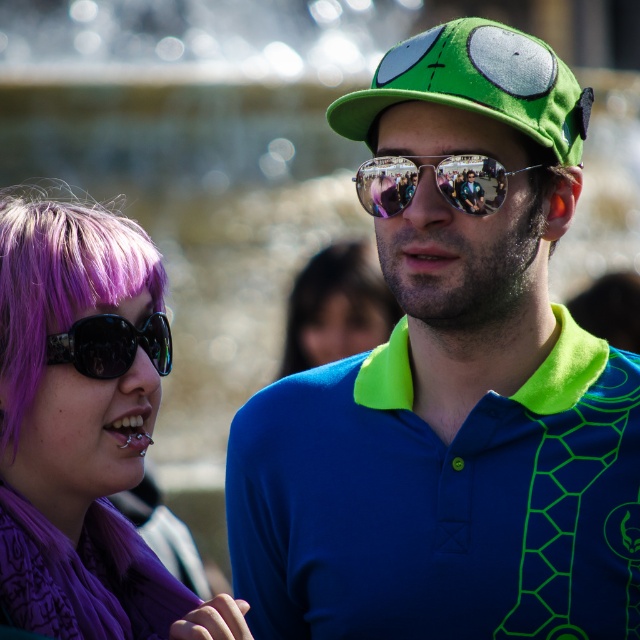
Question: Which object is farther from the camera taking this photo?

Choices:
 (A) purple hair at left
 (B) purple fabric scarf at left
 (C) matte green cap at upper right
 (D) shiny black sunglasses at lower left

Answer: (D)

Question: Can you confirm if matte green cap at upper right is bigger than green felt hat at upper center?

Choices:
 (A) no
 (B) yes

Answer: (B)

Question: Which object is the farthest from the matte green cap at upper right?

Choices:
 (A) purple hair at center
 (B) purple fabric scarf at left
 (C) green felt hat at upper center
 (D) reflective plastic goggles at center

Answer: (A)

Question: Which is farther from the matte green cap at upper right?

Choices:
 (A) shiny black sunglasses at lower left
 (B) reflective plastic goggles at center
 (C) green felt hat at upper center

Answer: (A)

Question: Does purple fabric scarf at left have a greater width compared to reflective plastic goggles at center?

Choices:
 (A) no
 (B) yes

Answer: (B)

Question: Is purple hair at left to the left of shiny black sunglasses at lower left from the viewer's perspective?

Choices:
 (A) yes
 (B) no

Answer: (A)